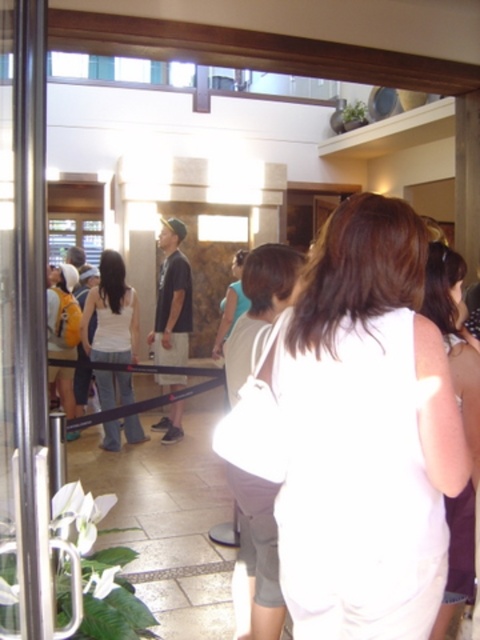
You are standing at the entrance of the modern building and see the white fabric shirt at center. There is another person wearing a light tank top and shorts. How far apart are these two individuals?

The white fabric shirt at center and the light tank top and shorts are 1.35 meters apart.